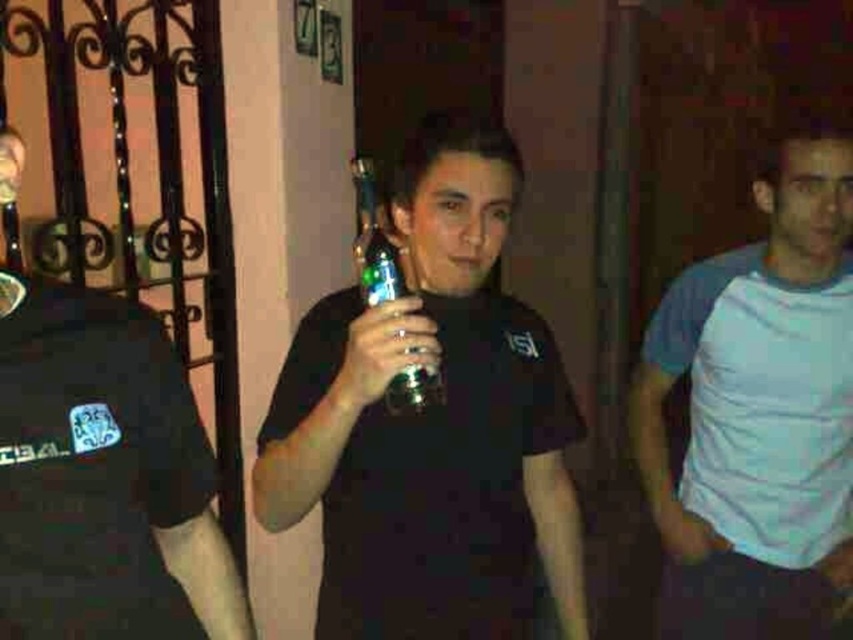
Which is in front, point (769, 403) or point (375, 198)?

Point (375, 198) is in front.

The image size is (853, 640). What do you see at coordinates (759, 408) in the screenshot?
I see `white cotton t-shirt at right` at bounding box center [759, 408].

The image size is (853, 640). I want to click on white cotton t-shirt at right, so click(x=759, y=408).

Does white cotton t-shirt at right have a lesser width compared to black matte t-shirt at left?

Incorrect, white cotton t-shirt at right's width is not less than black matte t-shirt at left's.

Can you confirm if white cotton t-shirt at right is positioned below black matte t-shirt at left?

Correct, white cotton t-shirt at right is located below black matte t-shirt at left.

Between point (695, 305) and point (109, 410), which one is positioned behind?

Point (695, 305)

Identify the location of white cotton t-shirt at right. (759, 408).

How far apart are black matte t-shirt at left and metallic green bottle at center?

The distance of black matte t-shirt at left from metallic green bottle at center is 32.87 centimeters.

Does point (141, 417) lie behind point (418, 388)?

No, (141, 417) is in front of (418, 388).

Does point (161, 481) come behind point (399, 372)?

Yes, point (161, 481) is farther from viewer.

The width and height of the screenshot is (853, 640). What are the coordinates of `black matte t-shirt at left` in the screenshot? It's located at (103, 477).